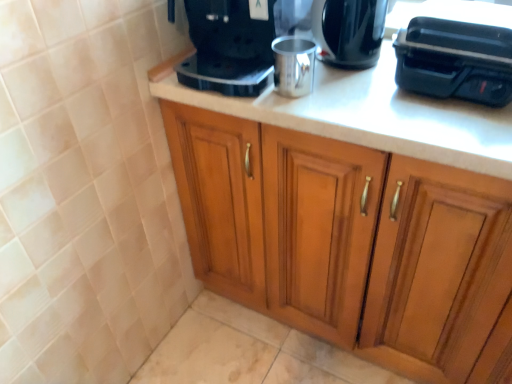
Image resolution: width=512 pixels, height=384 pixels. What are the coordinates of `vacant location below shiny black coffee maker at upper center (from a real-world perspective)` in the screenshot? It's located at (354, 69).